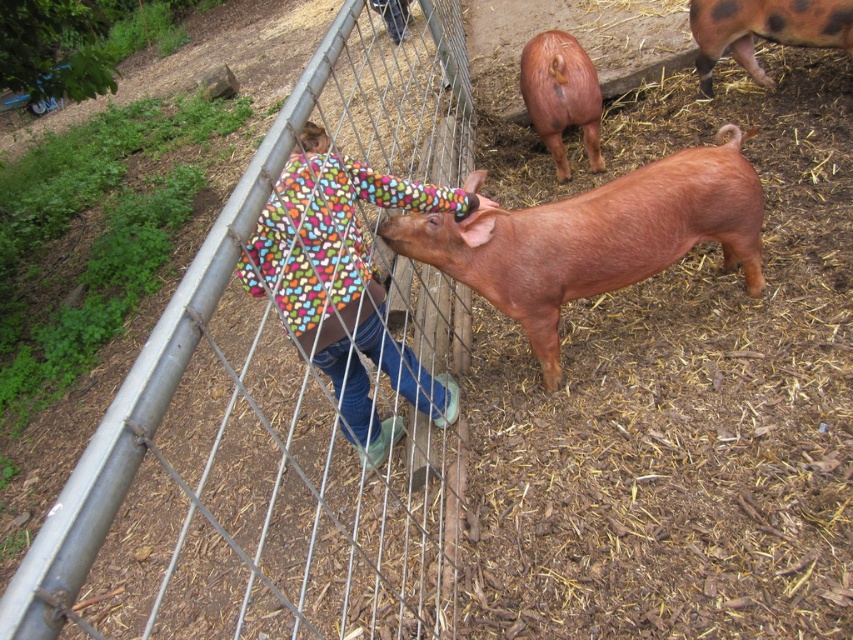
Is point (320, 358) farther from camera compared to point (767, 10)?

No.

Does multicolored fleece jacket at center appear on the left side of brown matte pig at center?

Yes, multicolored fleece jacket at center is to the left of brown matte pig at center.

Where is `multicolored fleece jacket at center`? multicolored fleece jacket at center is located at coordinates (345, 284).

In the scene shown: Measure the distance between smooth reddish-brown pig at center and multicolored fleece jacket at center.

They are 17.93 inches apart.

What do you see at coordinates (595, 237) in the screenshot? The height and width of the screenshot is (640, 853). I see `smooth reddish-brown pig at center` at bounding box center [595, 237].

Between point (631, 246) and point (271, 216), which one is positioned behind?

Point (631, 246)

You are a GUI agent. You are given a task and a screenshot of the screen. Output one action in this format:
    pyautogui.click(x=<x>, y=<y>)
    Task: Click on the smooth reddish-brown pig at center
    
    Given the screenshot: What is the action you would take?
    point(595,237)

Which of these two, metal wire fence at center or smooth reddish-brown pig at center, stands taller?

With more height is metal wire fence at center.

Based on the photo, can you confirm if metal wire fence at center is shorter than smooth reddish-brown pig at center?

Incorrect, metal wire fence at center's height does not fall short of smooth reddish-brown pig at center's.

The height and width of the screenshot is (640, 853). What are the coordinates of `metal wire fence at center` in the screenshot? It's located at (283, 396).

This screenshot has height=640, width=853. Identify the location of metal wire fence at center. (283, 396).